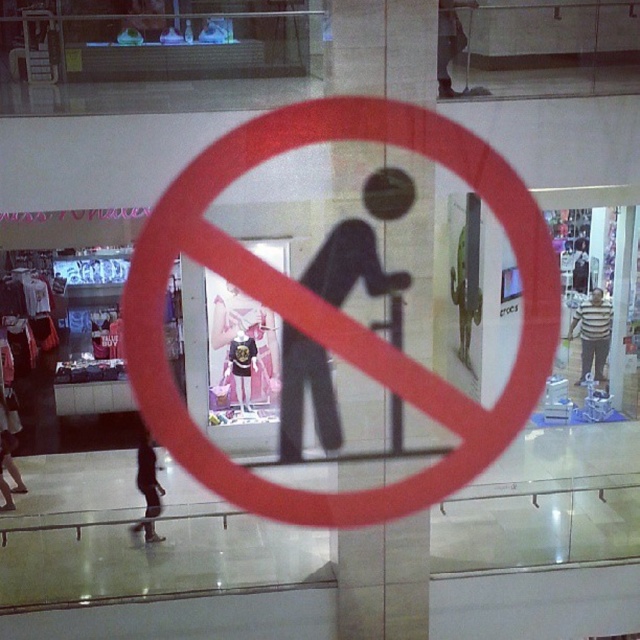
Question: From the image, what is the correct spatial relationship of black matte pillar at center in relation to striped shirt at center?

Choices:
 (A) above
 (B) below

Answer: (A)

Question: Considering the relative positions of black matte pillar at center and black matte figure at center in the image provided, where is black matte pillar at center located with respect to black matte figure at center?

Choices:
 (A) below
 (B) above

Answer: (B)

Question: Which point is farther from the camera taking this photo?

Choices:
 (A) (586, 356)
 (B) (420, 252)
 (C) (148, 464)

Answer: (A)

Question: Can you confirm if red circle sign at center is positioned to the left of matte black t-shirt at center?

Choices:
 (A) yes
 (B) no

Answer: (B)

Question: Which object appears closest to the camera in this image?

Choices:
 (A) matte black t-shirt at center
 (B) dark gray pants at lower left
 (C) striped shirt at center

Answer: (B)

Question: Estimate the real-world distances between objects in this image. Which object is farther from the black matte pillar at center?

Choices:
 (A) red circle sign at center
 (B) matte black t-shirt at center
 (C) black matte figure at center
 (D) dark gray pants at lower left

Answer: (D)